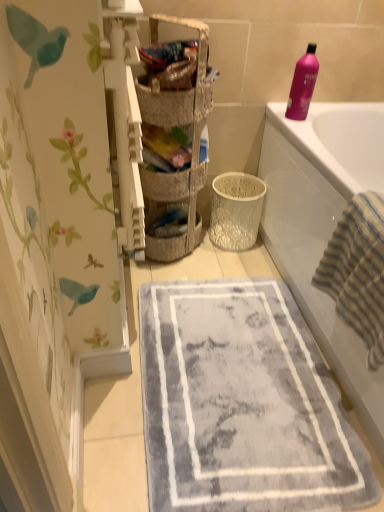
Question: From their relative heights in the image, would you say textured wicker basket at center, which ranks as the 2th basket in front-to-back order, is taller or shorter than striped cotton beach towel at right?

Choices:
 (A) tall
 (B) short

Answer: (B)

Question: Considering the relative positions of textured wicker basket at center, placed as the 1th basket when sorted from back to front, and striped cotton beach towel at right in the image provided, is textured wicker basket at center, placed as the 1th basket when sorted from back to front, to the left or to the right of striped cotton beach towel at right?

Choices:
 (A) right
 (B) left

Answer: (B)

Question: Estimate the real-world distances between objects in this image. Which object is farther from the woven fabric basket at upper center, placed as the second basket when sorted from back to front?

Choices:
 (A) gray plush bath mat at center
 (B) striped cotton beach towel at right
 (C) white glossy bathtub at upper right
 (D) woven basket at center
 (E) pink glossy bottle at upper right

Answer: (A)

Question: Which of these objects is positioned farthest from the pink glossy bottle at upper right?

Choices:
 (A) textured wicker basket at center, placed as the 1th basket when sorted from back to front
 (B) gray plush bath mat at center
 (C) woven basket at center
 (D) white glossy bathtub at upper right
 (E) striped cotton beach towel at right

Answer: (B)